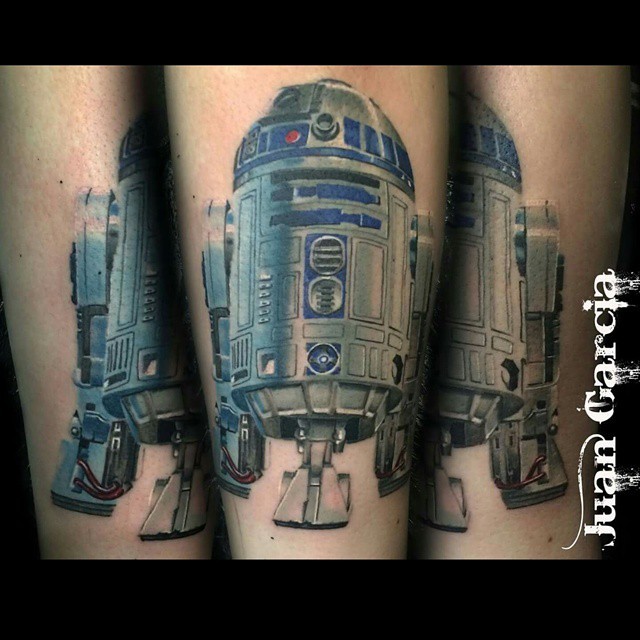
This screenshot has height=640, width=640. I want to click on red cable, so click(x=109, y=488), click(x=108, y=495), click(x=239, y=480), click(x=525, y=482).